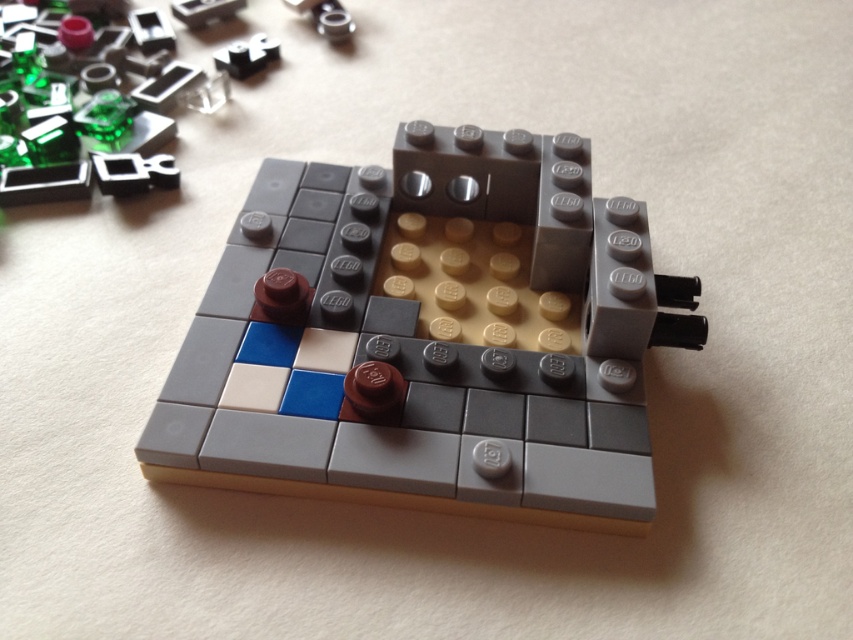
Question: Can you confirm if matte gray lego structure at center is positioned above transparent green plastic at upper left?

Choices:
 (A) no
 (B) yes

Answer: (A)

Question: Can you confirm if matte gray lego structure at center is positioned above transparent green plastic at upper left?

Choices:
 (A) yes
 (B) no

Answer: (B)

Question: Does matte gray lego structure at center appear on the right side of transparent green plastic at upper left?

Choices:
 (A) no
 (B) yes

Answer: (B)